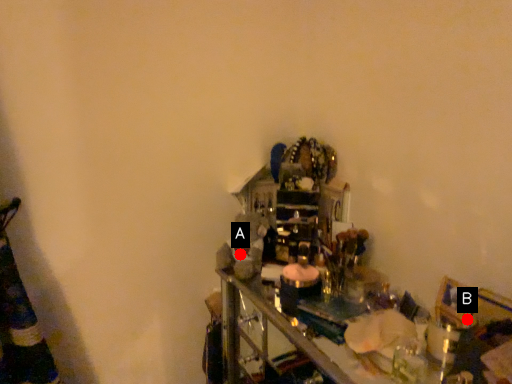
Question: Two points are circled on the image, labeled by A and B beside each circle. Which point is closer to the camera?

Choices:
 (A) A is closer
 (B) B is closer

Answer: (B)